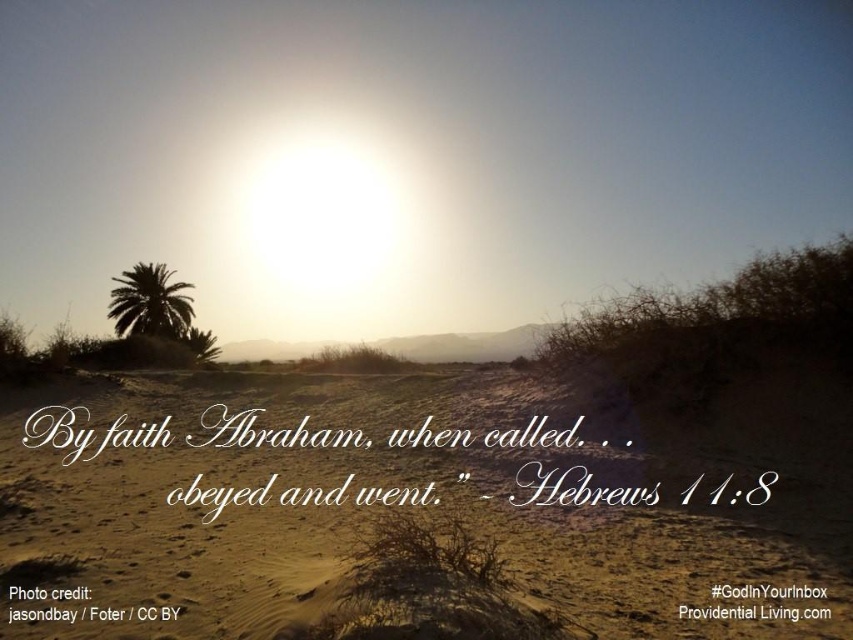
Question: Is sandy beige desert at center below silhouette palm tree at left?

Choices:
 (A) yes
 (B) no

Answer: (A)

Question: Does sandy beige desert at center have a lesser width compared to silhouette palm tree at left?

Choices:
 (A) no
 (B) yes

Answer: (A)

Question: Which object appears farthest from the camera in this image?

Choices:
 (A) silhouette palm tree at left
 (B) sandy beige desert at center

Answer: (A)

Question: Which point appears farthest from the camera in this image?

Choices:
 (A) (48, 509)
 (B) (183, 328)

Answer: (B)

Question: Is sandy beige desert at center bigger than silhouette palm tree at left?

Choices:
 (A) no
 (B) yes

Answer: (A)